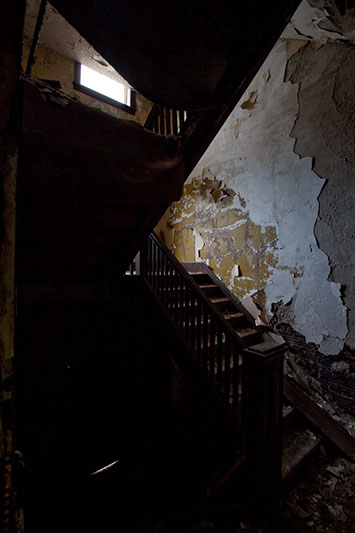
This screenshot has height=533, width=355. What are the coordinates of `under the staircase` in the screenshot? It's located at (187, 33).